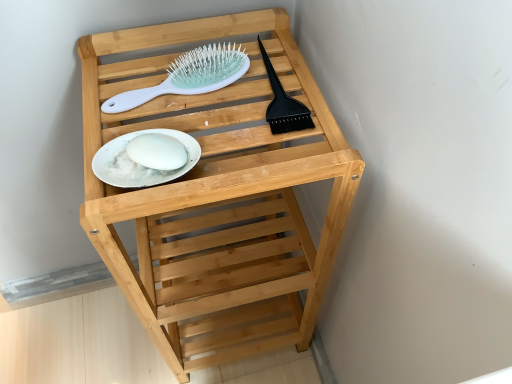
Where is `free space to the back side of white plastic hairbrush at upper center`? This screenshot has height=384, width=512. free space to the back side of white plastic hairbrush at upper center is located at coordinates (186, 42).